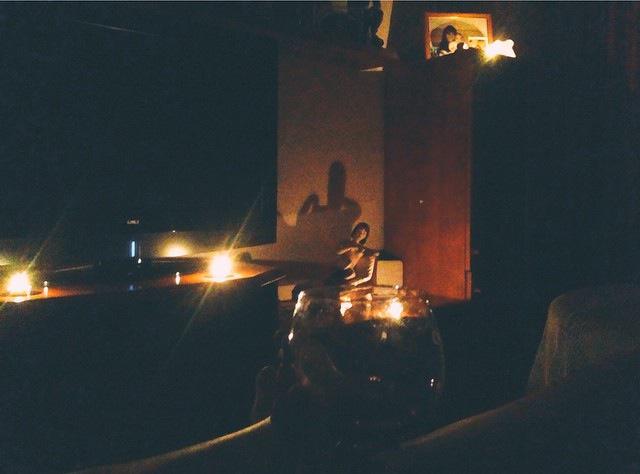
Locate an element on the screen. low wooden tv cabinet is located at coordinates (73, 286).